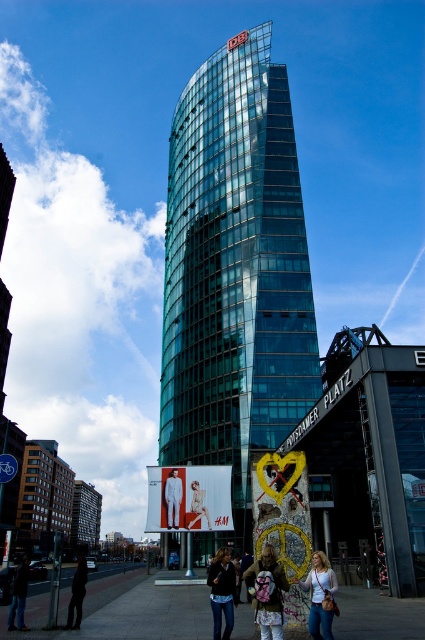
Question: Does white cotton backpack at center come in front of white cotton shirt at lower center?

Choices:
 (A) no
 (B) yes

Answer: (B)

Question: Is the position of concrete pavement at lower center less distant than that of white cotton shirt at lower center?

Choices:
 (A) no
 (B) yes

Answer: (B)

Question: Among these points, which one is farthest from the camera?

Choices:
 (A) (221, 554)
 (B) (204, 515)
 (C) (37, 636)

Answer: (B)

Question: Is transparent glass tower at center bigger than concrete pavement at lower center?

Choices:
 (A) yes
 (B) no

Answer: (A)

Question: Which object appears farthest from the camera in this image?

Choices:
 (A) metallic pole at center
 (B) white fabric person at center
 (C) white fabric pants at center
 (D) transparent glass tower at center

Answer: (D)

Question: Which point is closer to the camera?

Choices:
 (A) white fabric pants at center
 (B) white fabric person at center
 (C) metallic pole at center
 (D) white cotton shirt at lower center

Answer: (D)